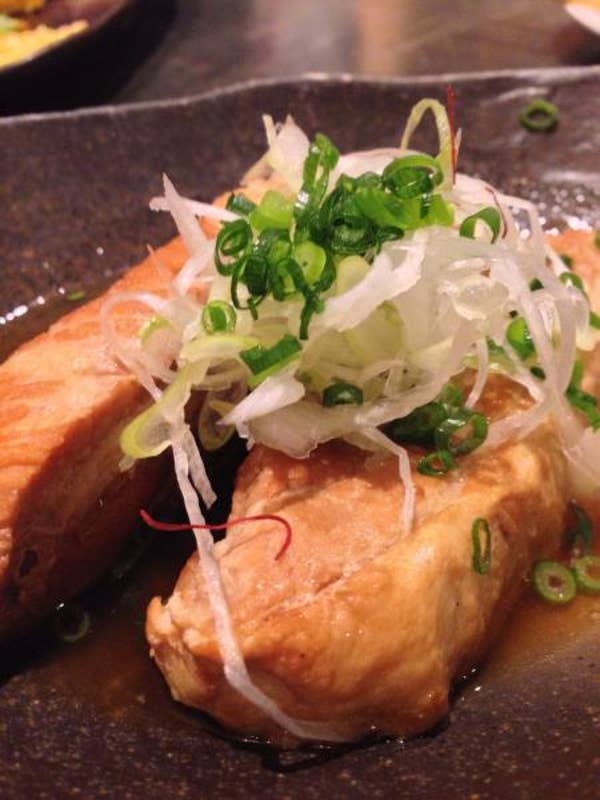
At what (x,y) coordinates should I click in order to perform the action: click on table. Please return your answer as a coordinate pair (x, y). Looking at the image, I should click on click(x=258, y=62).